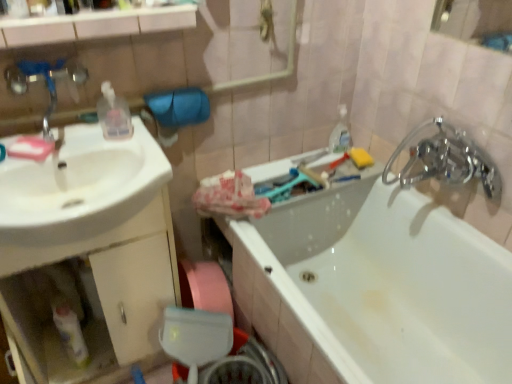
Question: Is yellow sponge at upper right, which is counted as the 1th soap, starting from the right, spatially inside brushed metal faucet at upper left, or outside of it?

Choices:
 (A) inside
 (B) outside

Answer: (B)

Question: In the image, is yellow sponge at upper right, which is the 1th soap in back-to-front order, positioned in front of or behind brushed metal faucet at upper left?

Choices:
 (A) front
 (B) behind

Answer: (B)

Question: Considering the real-world distances, which object is farthest from the clear plastic bottle at upper right?

Choices:
 (A) pink matte soap at left, the 2th soap when ordered from back to front
 (B) white glossy bathtub at center
 (C) translucent plastic bottle at lower left, which appears as the 1th bottle when ordered from the bottom
 (D) transparent plastic bottle at upper left, the 2th bottle when ordered from left to right
 (E) brushed metal faucet at upper left

Answer: (C)

Question: Considering the real-world distances, which object is closest to the translucent plastic bottle at lower left, acting as the second bottle starting from the right?

Choices:
 (A) yellow sponge at upper right, which is counted as the 1th soap, starting from the right
 (B) transparent plastic bottle at upper left, acting as the first bottle starting from the right
 (C) clear plastic bottle at upper right
 (D) pink matte soap at left, the 2th soap when ordered from back to front
 (E) chrome metallic faucet at upper right

Answer: (D)